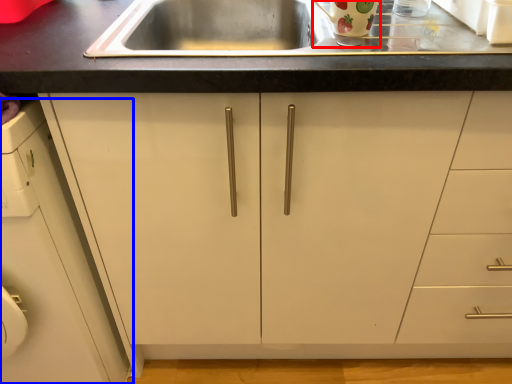
Question: Which object is further to the camera taking this photo, appliance (highlighted by a red box) or cabinetry (highlighted by a blue box)?

Choices:
 (A) appliance
 (B) cabinetry

Answer: (A)